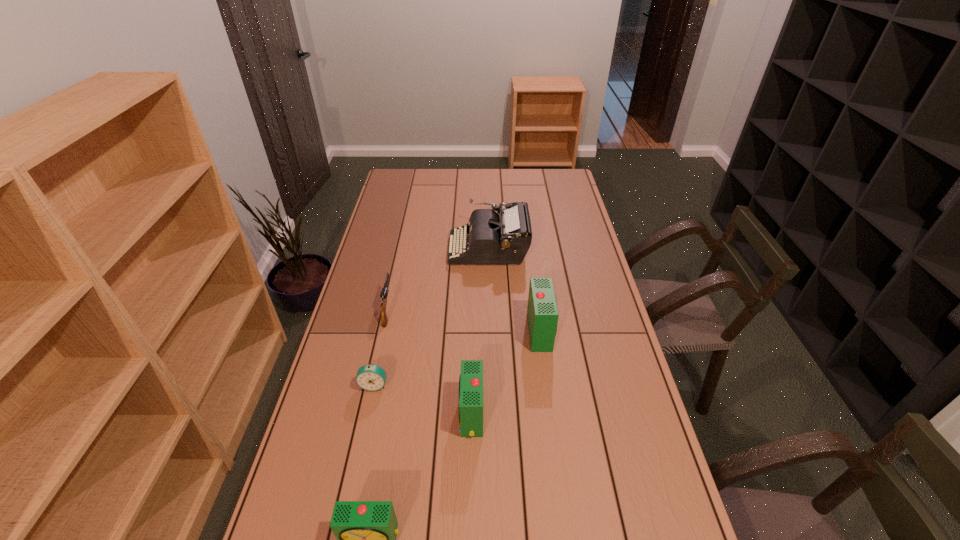
This screenshot has height=540, width=960. Identify the location of vacant space situated 0.160m on the front-facing side of the typewriter. (410, 248).

The height and width of the screenshot is (540, 960). I want to click on free space located on the front-facing side of the typewriter, so click(x=413, y=248).

You are a GUI agent. You are given a task and a screenshot of the screen. Output one action in this format:
    pyautogui.click(x=<x>, y=<y>)
    Task: Click on the free location located 0.140m on the front-facing side of the typewriter
    This screenshot has height=540, width=960.
    Given the screenshot: What is the action you would take?
    pyautogui.click(x=416, y=248)

At what (x,y) coordinates should I click in order to perform the action: click on vacant space situated 0.280m along the barrel of the gun. Please return your answer as a coordinate pair (x, y). Image resolution: width=960 pixels, height=540 pixels. Looking at the image, I should click on (401, 247).

The image size is (960, 540). I want to click on free space located 0.390m along the barrel of the gun, so [405, 232].

Locate an element on the screen. Image resolution: width=960 pixels, height=540 pixels. vacant space situated 0.330m along the barrel of the gun is located at coordinates (403, 240).

You are a GUI agent. You are given a task and a screenshot of the screen. Output one action in this format:
    pyautogui.click(x=<x>, y=<y>)
    Task: Click on the alarm clock that is at the left edge
    This screenshot has height=540, width=960.
    Given the screenshot: What is the action you would take?
    pyautogui.click(x=371, y=377)

This screenshot has height=540, width=960. I want to click on gun present at the left edge, so click(384, 292).

I want to click on vacant area at the far edge, so click(x=502, y=177).

You are a GUI agent. You are given a task and a screenshot of the screen. Output one action in this format:
    pyautogui.click(x=<x>, y=<y>)
    Task: Click on the free space at the left edge
    The image size is (960, 540).
    Given the screenshot: What is the action you would take?
    pyautogui.click(x=403, y=199)